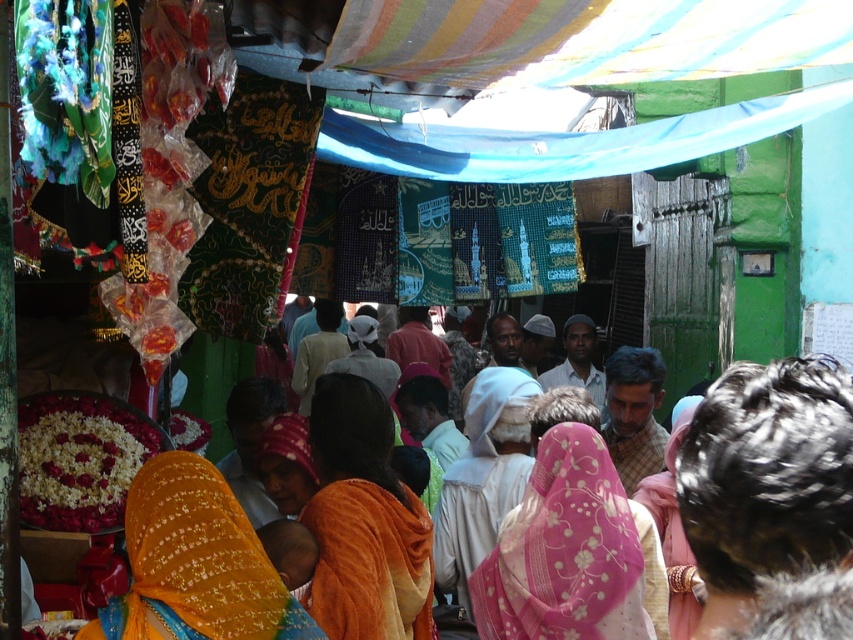
You are a vendor at the market and want to display the pink embroidered scarf at center and the embroidered orange sari at center on a single rack. Since the rack has limited vertical space, which item should you place higher up to ensure both items are visible?

The pink embroidered scarf at center is much taller than the embroidered orange sari at center. To ensure both items are visible on the rack with limited vertical space, place the taller pink embroidered scarf at center lower down so the shorter sari can be placed above it without being obscured.

You are a vendor at the market and want to hang a new banner between the orange fabric at center and the white fabric headscarf at center. Which fabric should you attach the banner to if you want it to be higher?

The white fabric headscarf at center is taller than the orange fabric at center, so you should attach the banner to the white fabric headscarf at center to have it higher.